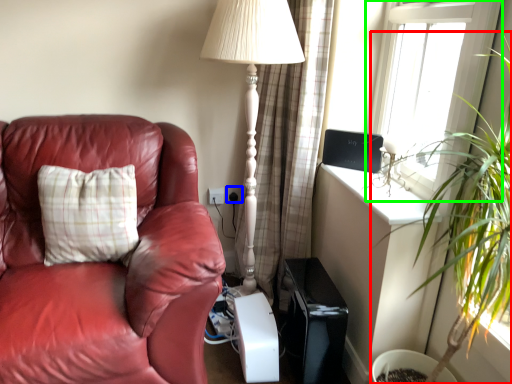
Question: Based on their relative distances, which object is farther from houseplant (highlighted by a red box)? Choose from electric outlet (highlighted by a blue box) and window (highlighted by a green box).

Choices:
 (A) electric outlet
 (B) window

Answer: (A)